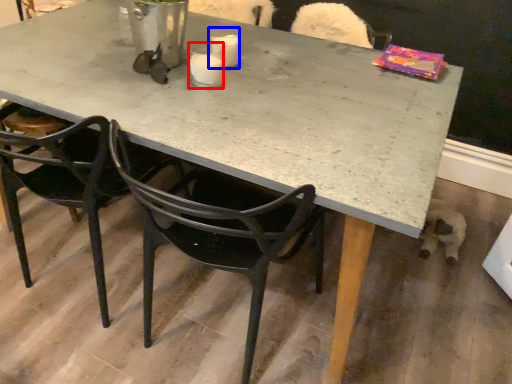
Question: Which point is further to the camera, coffee cup (highlighted by a red box) or coffee cup (highlighted by a blue box)?

Choices:
 (A) coffee cup
 (B) coffee cup

Answer: (B)